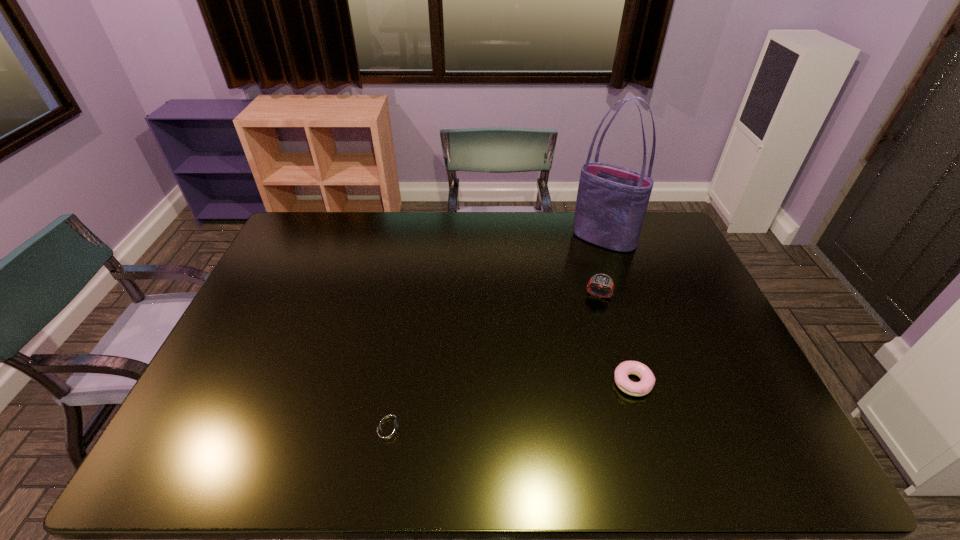
Identify the location of free space located 0.400m on the left of the doughnut. (459, 382).

The width and height of the screenshot is (960, 540). In order to click on free space located 0.330m on the face of the shortest object in this screenshot , I will do `click(550, 427)`.

The image size is (960, 540). I want to click on object present at the far edge, so click(611, 204).

Find the location of a particular element. This screenshot has width=960, height=540. object present at the near edge is located at coordinates (388, 427).

You are a GUI agent. You are given a task and a screenshot of the screen. Output one action in this format:
    pyautogui.click(x=<x>, y=<y>)
    Task: Click on the object that is at the right edge
    The width and height of the screenshot is (960, 540).
    Given the screenshot: What is the action you would take?
    pyautogui.click(x=611, y=204)

You are a GUI agent. You are given a task and a screenshot of the screen. Output one action in this format:
    pyautogui.click(x=<x>, y=<y>)
    Task: Click on the object that is at the far right corner
    This screenshot has width=960, height=540.
    Given the screenshot: What is the action you would take?
    pyautogui.click(x=611, y=204)

Image resolution: width=960 pixels, height=540 pixels. In order to click on vacant space at the far edge of the desktop in this screenshot , I will do `click(519, 239)`.

Find the location of `free spot at the near edge of the desktop`. free spot at the near edge of the desktop is located at coordinates (714, 444).

The width and height of the screenshot is (960, 540). In the image, there is a desktop. Identify the location of vacant region at the left edge. (265, 335).

Find the location of a particular element. vacant region at the right edge is located at coordinates (661, 296).